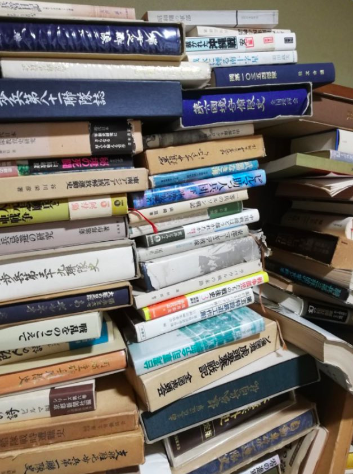
Find the location of a particular element. The width and height of the screenshot is (353, 474). gray book on top of middle pile is located at coordinates click(237, 15).